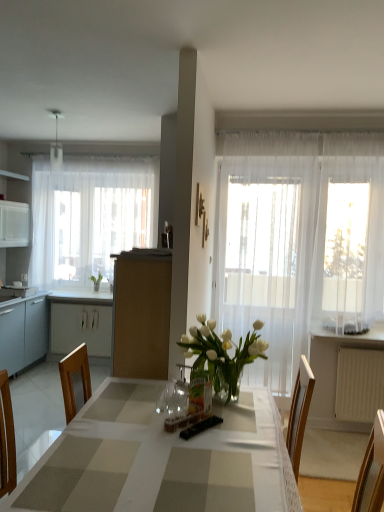
Where is `free location to the right of translucent glass vase at center`? The image size is (384, 512). free location to the right of translucent glass vase at center is located at coordinates (237, 414).